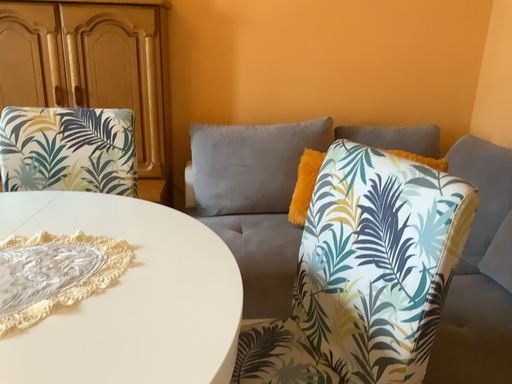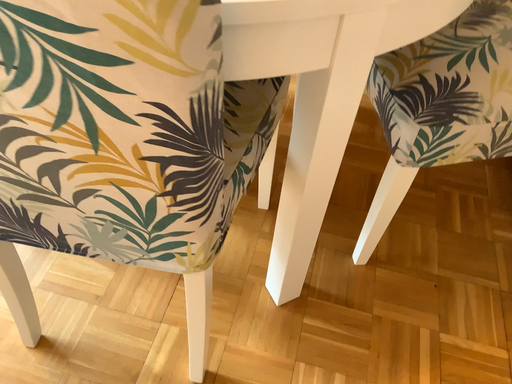
Question: Which way did the camera rotate in the video?

Choices:
 (A) rotated downward
 (B) rotated upward

Answer: (A)